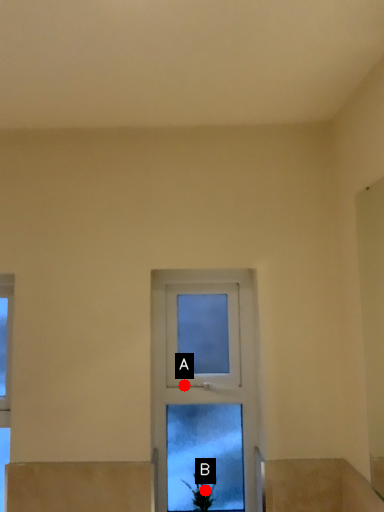
Question: Two points are circled on the image, labeled by A and B beside each circle. Which point appears farthest from the camera in this image?

Choices:
 (A) A is further
 (B) B is further

Answer: (A)